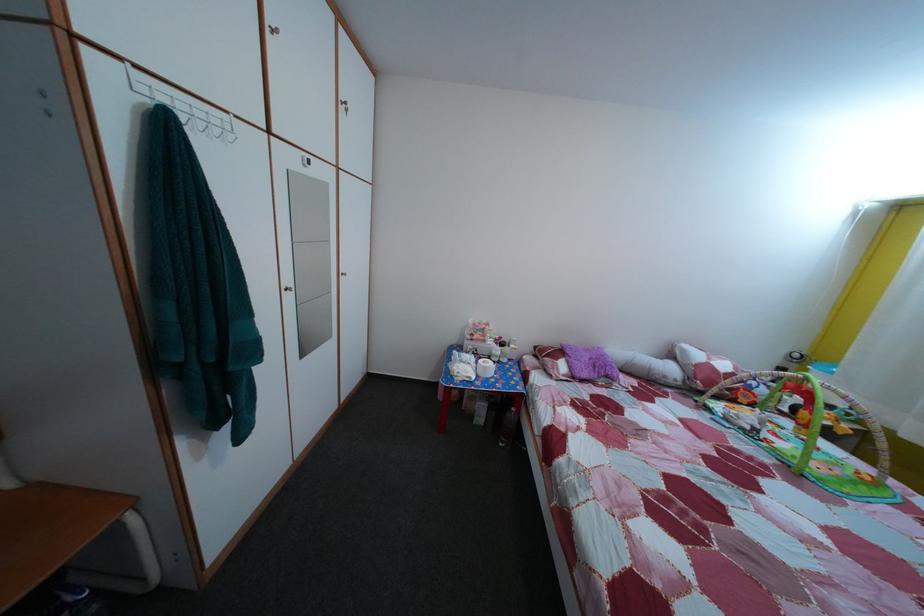
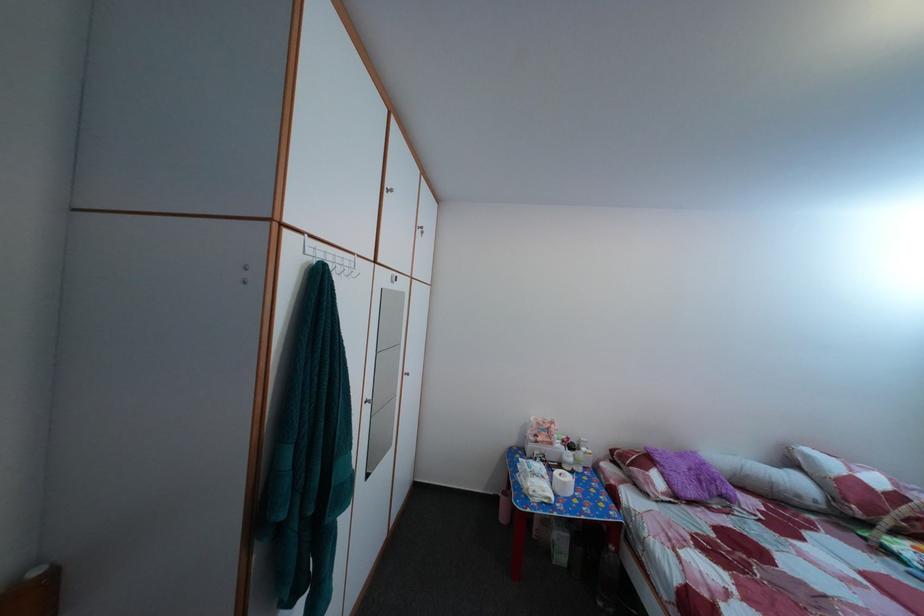
The point at (509,346) is marked in the first image. Where is the corresponding point in the second image?

(578, 447)